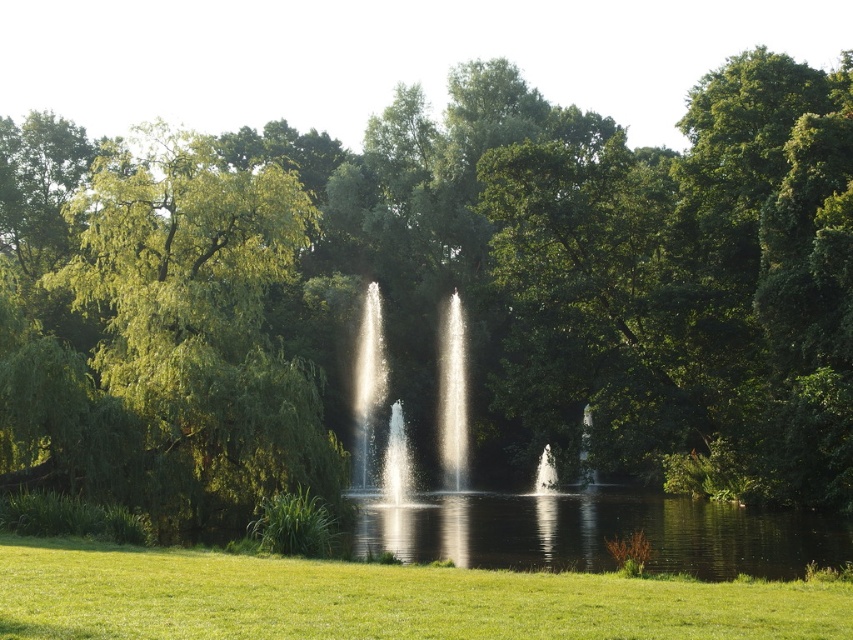
Between green leafy tree at left and green grass at lower center, which one appears on the right side from the viewer's perspective?

green grass at lower center

Does point (242, 332) come in front of point (187, 600)?

No, it is behind (187, 600).

Between point (67, 204) and point (811, 611), which one is positioned behind?

Point (67, 204)

Locate an element on the screen. green leafy tree at left is located at coordinates (195, 326).